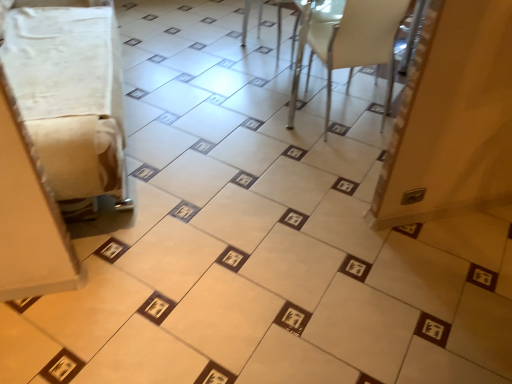
Question: From the image's perspective, is white fabric at left, acting as the second furniture starting from the right, above or below white plastic chair at upper right, which is counted as the 1th furniture, starting from the right?

Choices:
 (A) below
 (B) above

Answer: (A)

Question: Is white fabric at left, acting as the second furniture starting from the right, in front of or behind white plastic chair at upper right, which is counted as the 1th furniture, starting from the right, in the image?

Choices:
 (A) front
 (B) behind

Answer: (A)

Question: Choose the correct answer: Is white fabric at left, acting as the second furniture starting from the right, inside white plastic chair at upper right, which is counted as the 1th furniture, starting from the right, or outside it?

Choices:
 (A) outside
 (B) inside

Answer: (A)

Question: Does point 339,66 appear closer or farther from the camera than point 37,26?

Choices:
 (A) farther
 (B) closer

Answer: (B)

Question: Choose the correct answer: Is white plastic chair at upper right, which is counted as the 1th furniture, starting from the right, inside white fabric at left, which is the first furniture from left to right, or outside it?

Choices:
 (A) outside
 (B) inside

Answer: (A)

Question: From a real-world perspective, is white plastic chair at upper right, which is counted as the 1th furniture, starting from the right, above or below white fabric at left, which is the first furniture from left to right?

Choices:
 (A) below
 (B) above

Answer: (A)

Question: Considering the positions of white plastic chair at upper right, which ranks as the 2th furniture in left-to-right order, and white fabric at left, acting as the second furniture starting from the right, in the image, is white plastic chair at upper right, which ranks as the 2th furniture in left-to-right order, bigger or smaller than white fabric at left, acting as the second furniture starting from the right,?

Choices:
 (A) big
 (B) small

Answer: (B)